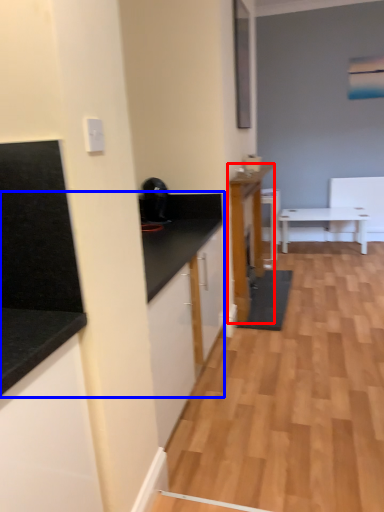
Question: Which object is further to the camera taking this photo, cabinetry (highlighted by a red box) or countertop (highlighted by a blue box)?

Choices:
 (A) cabinetry
 (B) countertop

Answer: (A)